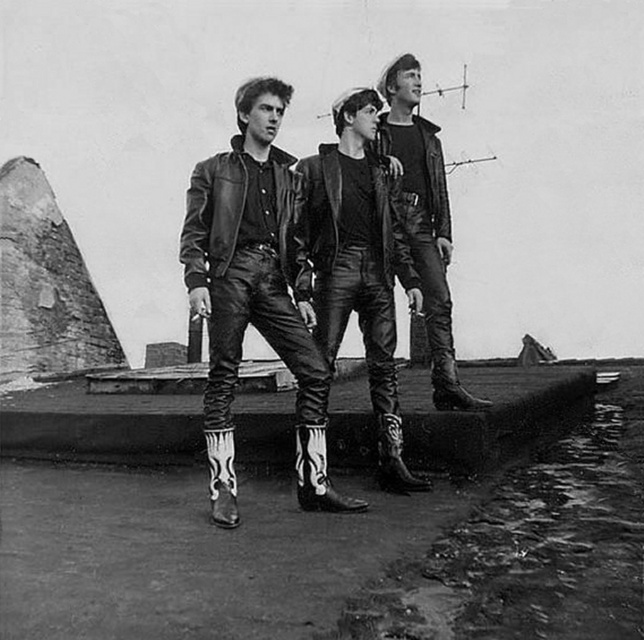
Question: Can you confirm if leather pants at center is bigger than leather jacket at center?

Choices:
 (A) yes
 (B) no

Answer: (B)

Question: Which point is closer to the camera?

Choices:
 (A) leather pants at center
 (B) leather jacket at center

Answer: (A)

Question: Does leather boots at center have a lesser width compared to leather pants at center?

Choices:
 (A) no
 (B) yes

Answer: (A)

Question: Which point is closer to the camera?

Choices:
 (A) (422, 237)
 (B) (361, 280)

Answer: (B)

Question: Does leather boots at center have a larger size compared to leather pants at center?

Choices:
 (A) yes
 (B) no

Answer: (A)

Question: Which point is farther to the camera?

Choices:
 (A) [355, 164]
 (B) [406, 184]
 (C) [269, 115]

Answer: (B)